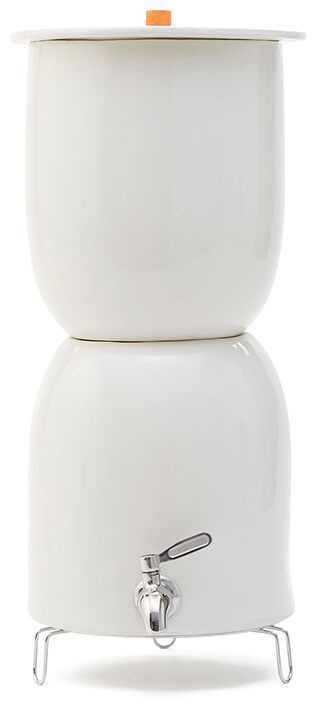
Where is `handle`? This screenshot has height=703, width=317. handle is located at coordinates (155, 18).